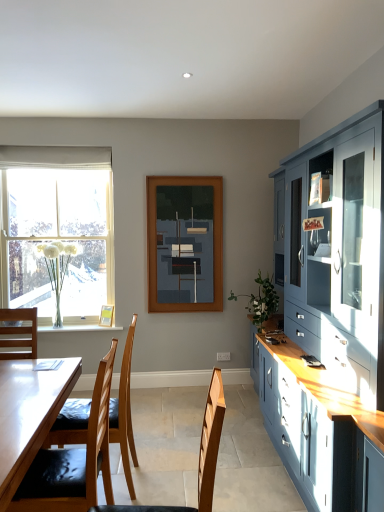
What do you see at coordinates (185, 243) in the screenshot? The height and width of the screenshot is (512, 384). I see `matte wooden frame at center` at bounding box center [185, 243].

What do you see at coordinates (199, 456) in the screenshot?
I see `wooden chair at center, which is counted as the third chair, starting from the back` at bounding box center [199, 456].

Describe the element at coordinates (55, 157) in the screenshot. I see `white sheer curtain at upper left` at that location.

Image resolution: width=384 pixels, height=512 pixels. Describe the element at coordinates (57, 269) in the screenshot. I see `white glass vase at left, the 2th plant when ordered from front to back` at that location.

What do you see at coordinates (57, 231) in the screenshot?
I see `clear glass vase at left` at bounding box center [57, 231].

Identify the location of green leafy plant at right, the 1th plant positioned from the right. (261, 301).

The image size is (384, 512). Describe the element at coordinates (261, 301) in the screenshot. I see `green leafy plant at right, which appears as the 2th plant when viewed from the left` at that location.

Locate an element on the screen. matte blue cabinet at right is located at coordinates (338, 251).

The image size is (384, 512). Identify the location of matte wooden frame at center. (185, 243).

Between matte yellow picture frame at window and white glass vase at left, which is the 1th plant from left to right, which one has more height?

white glass vase at left, which is the 1th plant from left to right, is taller.

Which point is more distant from viewer, (102, 322) or (52, 257)?

Point (52, 257)

Is matte yellow picture frame at window facing towards white glass vase at left, which is the second plant from right to left?

No, matte yellow picture frame at window is not aimed at white glass vase at left, which is the second plant from right to left.

Is the surface of white sheer curtain at upper left in direct contact with green leafy plant at right, placed as the 1th plant when sorted from front to back?

No, white sheer curtain at upper left is not in contact with green leafy plant at right, placed as the 1th plant when sorted from front to back.

Considering the sizes of objects white sheer curtain at upper left and green leafy plant at right, which ranks as the 2th plant in back-to-front order, in the image provided, who is wider, white sheer curtain at upper left or green leafy plant at right, which ranks as the 2th plant in back-to-front order,?

green leafy plant at right, which ranks as the 2th plant in back-to-front order, is wider.

Does point (46, 162) appear closer or farther from the camera than point (274, 290)?

Point (46, 162) is farther from the camera than point (274, 290).

What are the coordinates of `curtain lying on the left of wooden chair at center, the 1th chair viewed from the front` in the screenshot? It's located at (55, 157).

Can you confirm if wooden chair at center, which is counted as the third chair, starting from the back, is positioned to the left of white sheer curtain at upper left?

In fact, wooden chair at center, which is counted as the third chair, starting from the back, is to the right of white sheer curtain at upper left.

From the image's perspective, is wooden chair at center, which is counted as the third chair, starting from the back, beneath white sheer curtain at upper left?

Correct, wooden chair at center, which is counted as the third chair, starting from the back, appears lower than white sheer curtain at upper left in the image.

Considering the sizes of objects wooden chair at center, which is counted as the third chair, starting from the back, and white sheer curtain at upper left in the image provided, who is smaller, wooden chair at center, which is counted as the third chair, starting from the back, or white sheer curtain at upper left?

With smaller size is white sheer curtain at upper left.

How many degrees apart are the facing directions of wooden chair at center, the 1th chair viewed from the front, and matte blue cabinet at right?

The angle between the facing direction of wooden chair at center, the 1th chair viewed from the front, and the facing direction of matte blue cabinet at right is 4.17 degrees.

From a real-world perspective, is wooden chair at center, the 1th chair viewed from the front, over matte blue cabinet at right?

Actually, wooden chair at center, the 1th chair viewed from the front, is physically below matte blue cabinet at right in the real world.

Considering the positions of objects wooden chair at center, which is counted as the third chair, starting from the back, and matte blue cabinet at right in the image provided, who is more to the right, wooden chair at center, which is counted as the third chair, starting from the back, or matte blue cabinet at right?

matte blue cabinet at right is more to the right.

Is wooden chair at center, the 1th chair viewed from the front, far away from matte blue cabinet at right?

Yes, wooden chair at center, the 1th chair viewed from the front, and matte blue cabinet at right are located far from each other.

Which of these two, matte blue cabinet at right or clear glass vase at lower left, is smaller?

clear glass vase at lower left.

Is clear glass vase at lower left surrounded by matte blue cabinet at right?

No, matte blue cabinet at right does not contain clear glass vase at lower left.

Could you tell me if matte blue cabinet at right is facing clear glass vase at lower left?

Yes, matte blue cabinet at right is oriented towards clear glass vase at lower left.

Considering the relative positions of matte blue cabinet at right and clear glass vase at lower left in the image provided, is matte blue cabinet at right to the left or to the right of clear glass vase at lower left?

In the image, matte blue cabinet at right appears on the right side of clear glass vase at lower left.

From their relative heights in the image, would you say matte blue cabinet at right is taller or shorter than white glass vase at left, which is the 1th plant from left to right?

Clearly, matte blue cabinet at right is taller compared to white glass vase at left, which is the 1th plant from left to right.

Between point (361, 155) and point (56, 318), which one is positioned behind?

The point (56, 318) is farther.

Looking at this image, from a real-world perspective, is matte blue cabinet at right beneath white glass vase at left, which is the 1th plant from left to right?

No, from a real-world perspective, matte blue cabinet at right is not under white glass vase at left, which is the 1th plant from left to right.

From the image's perspective, which object appears higher, matte blue cabinet at right or white glass vase at left, which is the second plant from right to left?

white glass vase at left, which is the second plant from right to left, is shown above in the image.

Is light brown wooden chair at left, which is the first chair in back-to-front order, at the right side of matte blue cabinet at right?

In fact, light brown wooden chair at left, which is the first chair in back-to-front order, is to the left of matte blue cabinet at right.

Considering the points (79, 421) and (304, 312), which point is in front, point (79, 421) or point (304, 312)?

The point (79, 421) is closer to the camera.

Is light brown wooden chair at left, the third chair in the front-to-back sequence, bigger or smaller than matte blue cabinet at right?

light brown wooden chair at left, the third chair in the front-to-back sequence, is smaller than matte blue cabinet at right.

Who is shorter, light brown wooden chair at left, which is the first chair in back-to-front order, or matte blue cabinet at right?

light brown wooden chair at left, which is the first chair in back-to-front order, is shorter.

Locate an element on the screen. Image resolution: width=384 pixels, height=512 pixels. picture frame below the white glass vase at left, which is the second plant from right to left (from the image's perspective) is located at coordinates (106, 315).

From the white sheer curtain at upper left, count 2nd plants forward and point to it. Please provide its 2D coordinates.

[(261, 301)]

From the image, which object appears to be nearer to clear glass vase at lower left, matte blue cabinet at right or white sheer curtain at upper left?

The object closer to clear glass vase at lower left is white sheer curtain at upper left.

Looking at the image, which one is located closer to light brown wooden chair at left, the third chair in the front-to-back sequence, white glass vase at left, the first plant in the back-to-front sequence, or green leafy plant at right, placed as the 1th plant when sorted from front to back?

green leafy plant at right, placed as the 1th plant when sorted from front to back, is positioned closer to the anchor light brown wooden chair at left, the third chair in the front-to-back sequence.

When comparing their distances from white sheer curtain at upper left, does white glass vase at left, which is the 1th plant from left to right, or green leafy plant at right, the 1th plant positioned from the right, seem further?

green leafy plant at right, the 1th plant positioned from the right, is positioned further to the anchor white sheer curtain at upper left.

Considering their positions, is wooden chair at left, placed as the 2th chair when sorted from back to front, positioned closer to matte blue cabinet at right than green leafy plant at right, placed as the 1th plant when sorted from front to back?

green leafy plant at right, placed as the 1th plant when sorted from front to back, lies closer to matte blue cabinet at right than the other object.

Looking at the image, which one is located closer to white glass vase at left, which is the second plant from right to left, wooden chair at left, placed as the 2th chair when sorted from back to front, or clear glass vase at lower left?

clear glass vase at lower left.

Which object lies further to the anchor point green leafy plant at right, which ranks as the 2th plant in back-to-front order, matte wooden frame at center or clear glass vase at left?

clear glass vase at left.

When comparing their distances from wooden chair at left, placed as the 2th chair when sorted from back to front, does clear glass vase at lower left or matte yellow picture frame at window seem further?

matte yellow picture frame at window is further to wooden chair at left, placed as the 2th chair when sorted from back to front.

Which object lies nearer to the anchor point light brown wooden chair at left, the third chair in the front-to-back sequence, green leafy plant at right, placed as the 1th plant when sorted from front to back, or clear glass vase at left?

green leafy plant at right, placed as the 1th plant when sorted from front to back, is closer to light brown wooden chair at left, the third chair in the front-to-back sequence.

The image size is (384, 512). In order to click on cabinetry between wooden chair at center, the 1th chair viewed from the front, and clear glass vase at left, along the z-axis in this screenshot , I will do `click(338, 251)`.

Identify the location of window screen between wooden chair at center, which is counted as the third chair, starting from the back, and clear glass vase at lower left in the front-back direction. The width and height of the screenshot is (384, 512). (185, 243).

I want to click on window screen between wooden chair at center, which is counted as the third chair, starting from the back, and matte yellow picture frame at window from front to back, so click(185, 243).

Where is `window screen between clear glass vase at lower left and green leafy plant at right, placed as the 1th plant when sorted from front to back, from left to right`? This screenshot has height=512, width=384. window screen between clear glass vase at lower left and green leafy plant at right, placed as the 1th plant when sorted from front to back, from left to right is located at coordinates (185, 243).